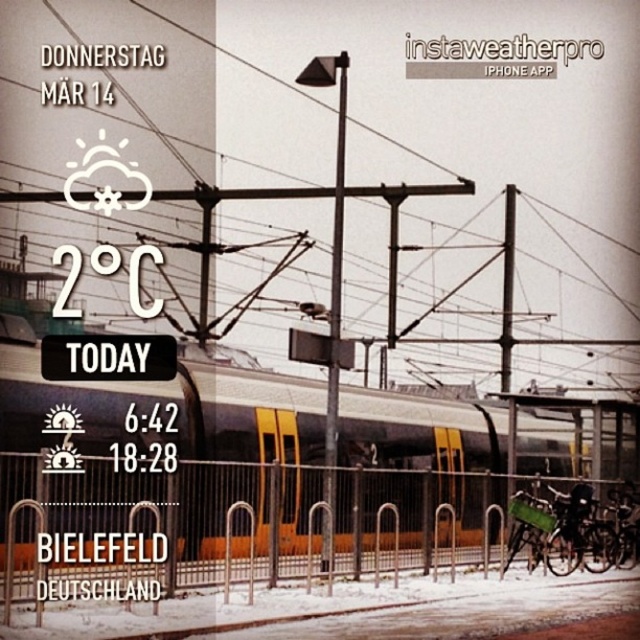
Between metallic silver train at center and metallic pole at center, which one appears on the left side from the viewer's perspective?

From the viewer's perspective, metallic silver train at center appears more on the left side.

Is point (460, 440) farther from camera compared to point (336, 385)?

Yes, it is behind point (336, 385).

Which is behind, point (474, 444) or point (333, 460)?

The point (474, 444) is more distant.

The height and width of the screenshot is (640, 640). In order to click on metallic silver train at center in this screenshot , I will do (x=170, y=417).

Is metallic silver fence at lower center wider than metallic pole at center?

Yes.

Does point (221, 513) lie in front of point (323, 554)?

Yes, point (221, 513) is in front of point (323, 554).

Locate an element on the screen. This screenshot has width=640, height=640. metallic silver fence at lower center is located at coordinates tap(232, 538).

Is metallic silver fence at lower center below metallic silver train at center?

Yes.

Does metallic silver fence at lower center appear on the right side of metallic silver train at center?

Correct, you'll find metallic silver fence at lower center to the right of metallic silver train at center.

Measure the distance between metallic silver fence at lower center and camera.

They are 11.90 meters apart.

Where is `metallic silver fence at lower center`? Image resolution: width=640 pixels, height=640 pixels. metallic silver fence at lower center is located at coordinates (232, 538).